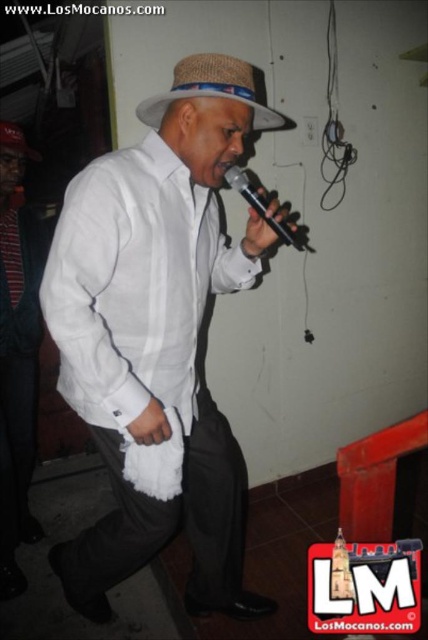
Consider the image. You are a photographer at the event and want to capture a clear shot of both the woven straw hat at center and the woven straw fedora at upper center. Which of the two hats will appear larger in your photo?

The woven straw hat at center will appear larger in the photo because it is closer to the viewer than the woven straw fedora at upper center.